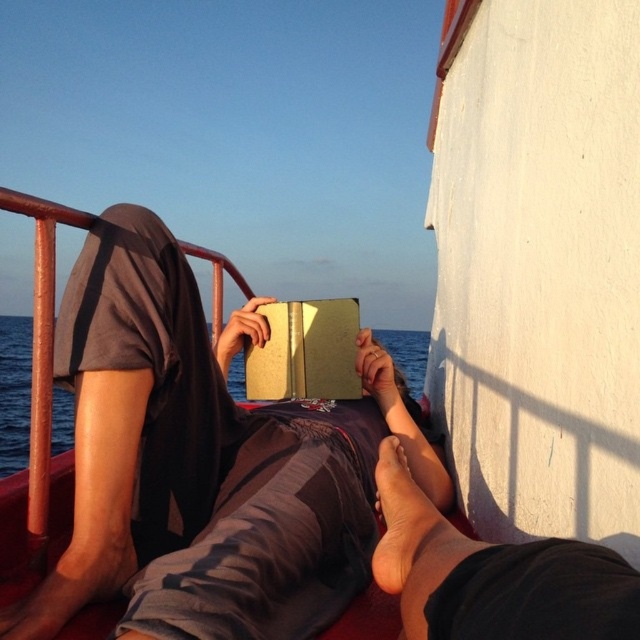
Question: Is matte brown book at center positioned at the back of gold paper book at center?

Choices:
 (A) no
 (B) yes

Answer: (A)

Question: Can you confirm if matte brown book at center is positioned to the right of leather-bound book at center?

Choices:
 (A) yes
 (B) no

Answer: (B)

Question: Which object is positioned farthest from the leather-bound book at center?

Choices:
 (A) matte brown book at center
 (B) brown skin at lower center
 (C) gold paper book at center

Answer: (C)

Question: Can you confirm if matte brown book at center is bigger than brown skin at lower center?

Choices:
 (A) yes
 (B) no

Answer: (A)

Question: Which is farther from the gold paper book at center?

Choices:
 (A) brown skin at lower center
 (B) leather-bound book at center
 (C) matte brown book at center

Answer: (A)

Question: Estimate the real-world distances between objects in this image. Which object is farther from the brown skin at lower center?

Choices:
 (A) leather-bound book at center
 (B) matte brown book at center
 (C) gold paper book at center

Answer: (C)